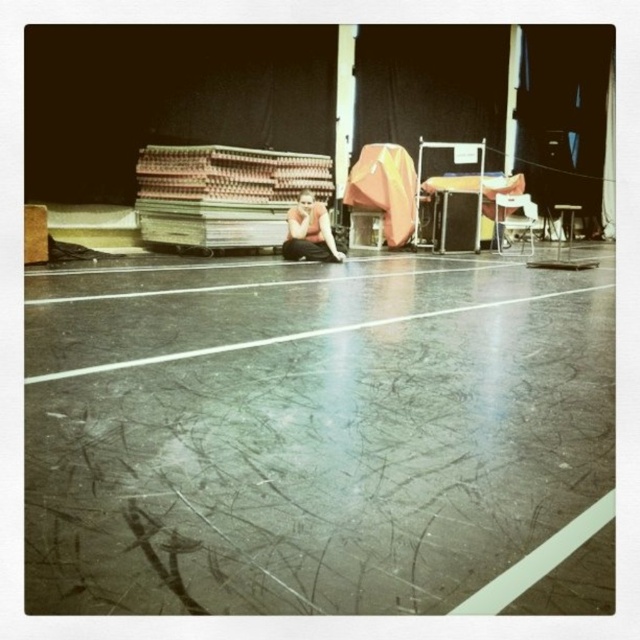
You are a stagehand setting up equipment in the rehearsal space. You need to move the wooden planks at center and the matte black squat at center to the left side of the image. Which object should you move first to ensure they are placed in the correct order as shown in the original image?

You should move the wooden planks at center first because in the original image, the wooden planks at center is to the left of the matte black squat at center. By moving the wooden planks at center first to the left, you can position it to the left of the matte black squat at center, maintaining their original spatial relationship.